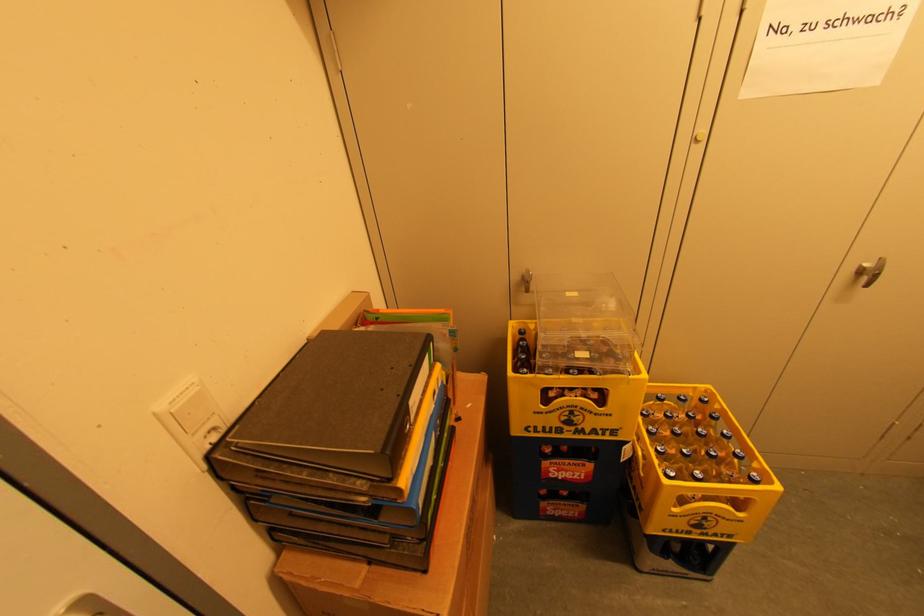
You are a GUI agent. You are given a task and a screenshot of the screen. Output one action in this format:
    pyautogui.click(x=<x>, y=<y>)
    Task: Click on the yellow crate handle
    The width and height of the screenshot is (924, 616).
    Given the screenshot: What is the action you would take?
    pyautogui.click(x=710, y=491)